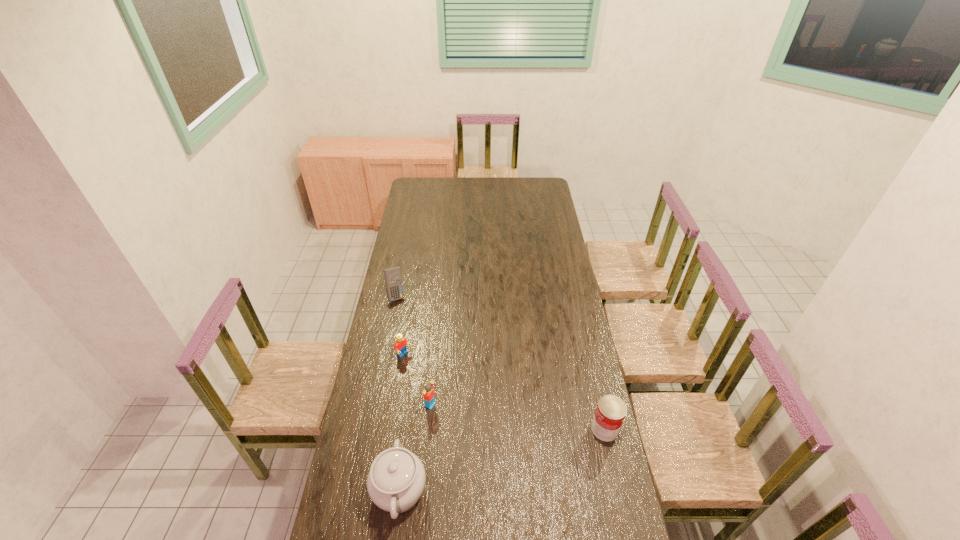
Identify the location of vacant space situated 0.390m on the face of the right Lego. (529, 454).

Locate an element on the screen. The height and width of the screenshot is (540, 960). vacant space located on the face of the right Lego is located at coordinates (516, 447).

You are a GUI agent. You are given a task and a screenshot of the screen. Output one action in this format:
    pyautogui.click(x=<x>, y=<y>)
    Task: Click on the vacant space situated 0.260m on the face of the right Lego
    The image size is (960, 540).
    Given the screenshot: What is the action you would take?
    pyautogui.click(x=496, y=437)

Where is `free space located on the face of the farther Lego`? Image resolution: width=960 pixels, height=540 pixels. free space located on the face of the farther Lego is located at coordinates (444, 385).

Image resolution: width=960 pixels, height=540 pixels. Find the location of `vacant space located 0.400m on the face of the farther Lego`. vacant space located 0.400m on the face of the farther Lego is located at coordinates (483, 414).

I want to click on vacant space located 0.330m on the face of the farther Lego, so click(x=468, y=403).

Image resolution: width=960 pixels, height=540 pixels. I want to click on vacant area situated 0.250m on the front-facing side of the calculator, so click(x=416, y=341).

You are a GUI agent. You are given a task and a screenshot of the screen. Output one action in this format:
    pyautogui.click(x=<x>, y=<y>)
    Task: Click on the vacant region located 0.140m on the front-facing side of the calculator
    
    Given the screenshot: What is the action you would take?
    408,323

At what (x,y) coordinates should I click in order to perform the action: click on blank area located on the front-facing side of the calculator. Please return your answer as a coordinate pair (x, y). Image resolution: width=960 pixels, height=540 pixels. Looking at the image, I should click on (425, 361).

The image size is (960, 540). Identify the location of object at the near edge. (396, 480).